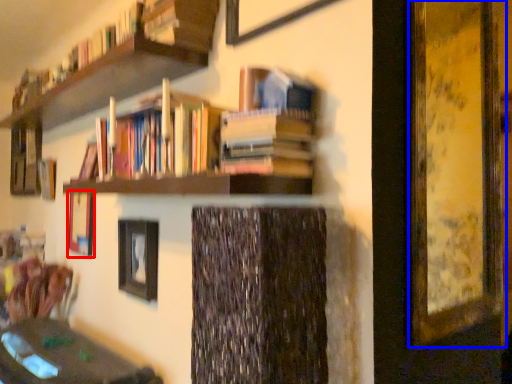
Question: Which point is further to the camera, picture frame (highlighted by a red box) or picture frame (highlighted by a blue box)?

Choices:
 (A) picture frame
 (B) picture frame

Answer: (A)